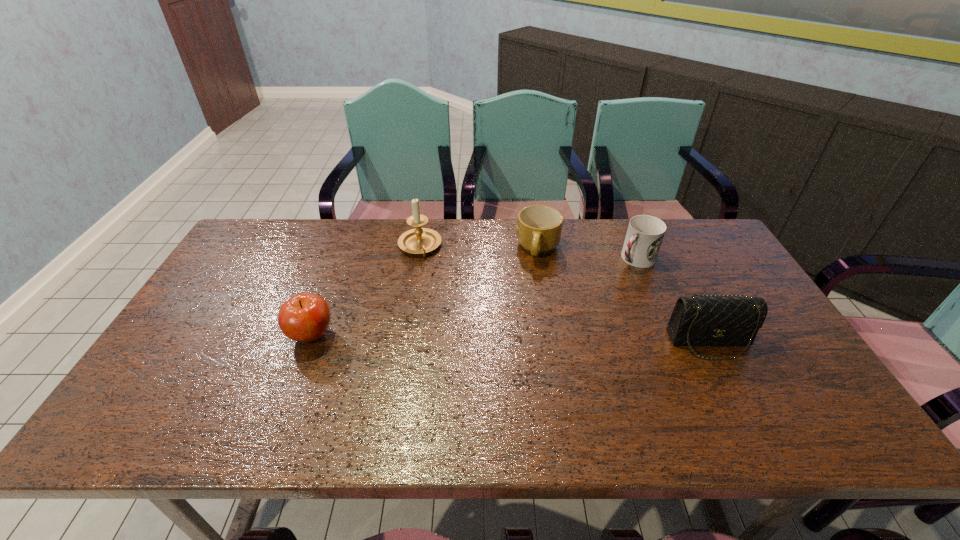
I want to click on vacant spot on the desktop that is between the apple and the clutch bag and is positioned on the handle side of the cup, so click(540, 339).

At what (x,y) coordinates should I click in order to perform the action: click on vacant spot on the desktop that is between the leftmost object and the clutch bag and is positioned with a handle on the side of the candle holder. Please return your answer as a coordinate pair (x, y). The image size is (960, 540). Looking at the image, I should click on (457, 338).

Image resolution: width=960 pixels, height=540 pixels. I want to click on vacant space on the desktop that is between the apple and the clutch bag and is positioned on the side with the handle of the mug, so click(x=489, y=338).